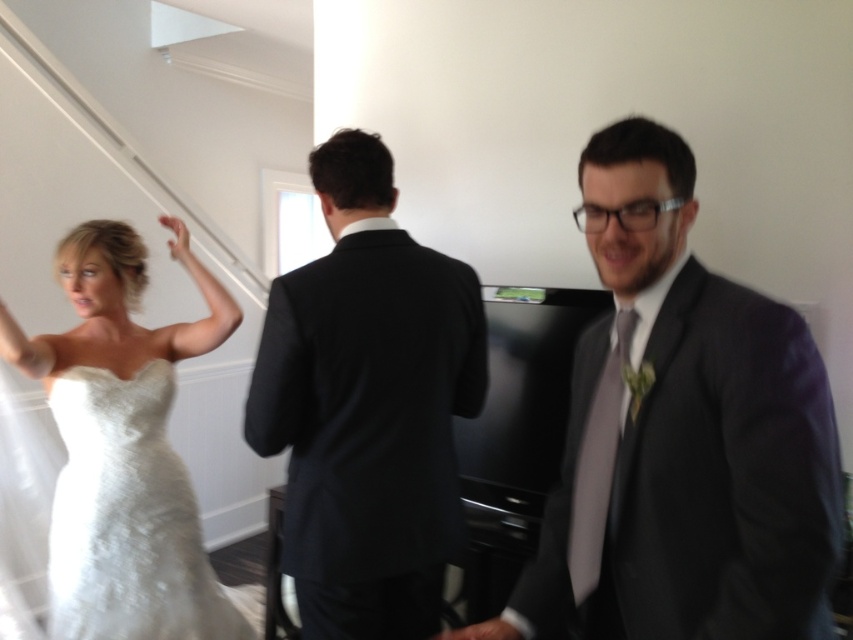
You are a photographer at a wedding reception. You need to capture a photo of both the matte gray suit at center and the dark suit at center. Based on their positions, which one is on the right side when facing the same direction as the camera?

The matte gray suit at center is to the right of the dark suit at center, so when facing the same direction as the camera, the matte gray suit at center is on the right side.

You are a photographer at a wedding and need to adjust the camera focus. The dark suit at center and the satin white dress at left are both in the frame. Which one is shorter?

The dark suit at center is not as tall as the satin white dress at left, so the dark suit at center is shorter.